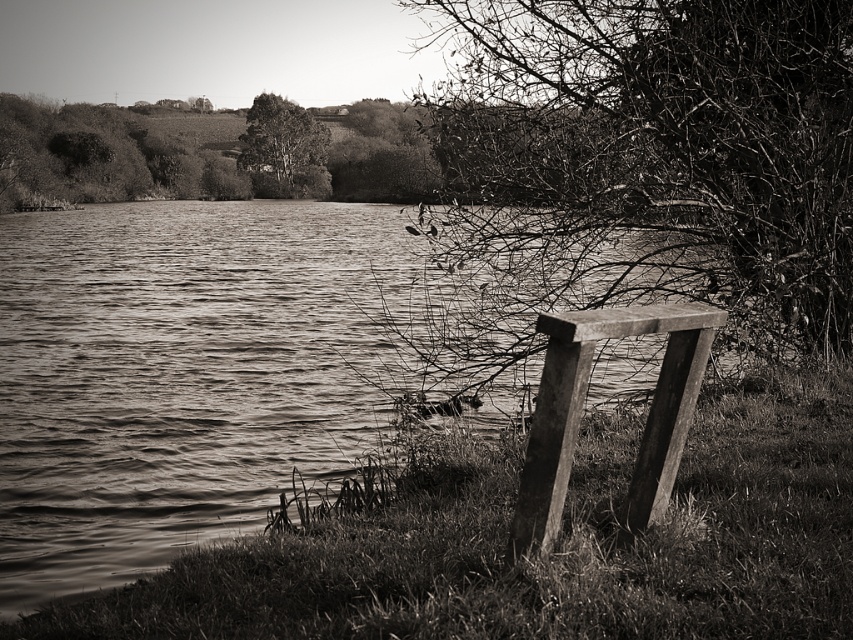
You are a photographer planning to capture the smooth water at lower left and the smooth bark tree at upper center in a single shot. Based on the scene, which object occupies a larger portion of the frame?

The smooth water at lower left might be wider than smooth bark tree at upper center, so it could occupy a larger portion of the frame.

You are a photographer wanting to capture the wooden plank bench at right and the smooth bark tree at upper center in the same frame. Based on their positions, can you tell me if the bench is located beneath the tree?

The wooden plank bench at right is positioned under the smooth bark tree at upper center, so yes, the bench is located beneath the tree.

You are an artist planning to sketch this lakeside scene. You want to ensure the smooth bark tree at right and the wooden plank bench at right are placed correctly relative to each other. According to the scene, which object is more to the right?

The smooth bark tree at right is positioned on the right side of the wooden plank bench at right, so the smooth bark tree at right is more to the right.